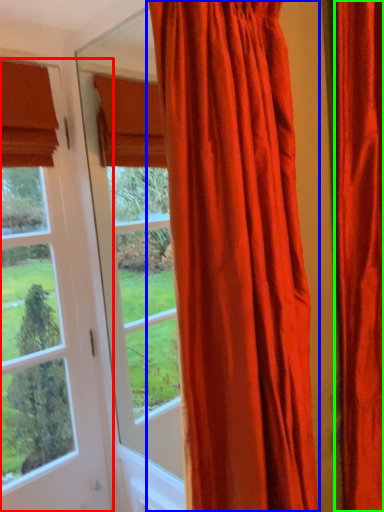
Question: Which is farther away from window (highlighted by a red box)? curtain (highlighted by a blue box) or curtain (highlighted by a green box)?

Choices:
 (A) curtain
 (B) curtain

Answer: (B)